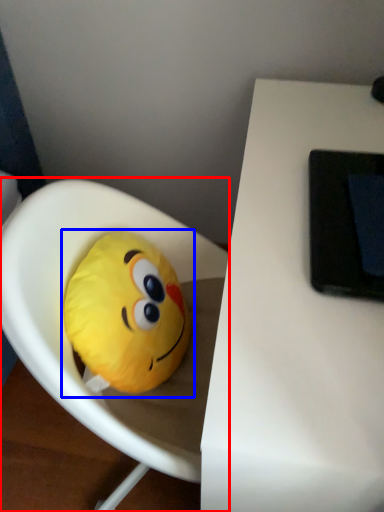
Question: Among these objects, which one is nearest to the camera, toy (highlighted by a red box) or toy (highlighted by a blue box)?

Choices:
 (A) toy
 (B) toy

Answer: (A)